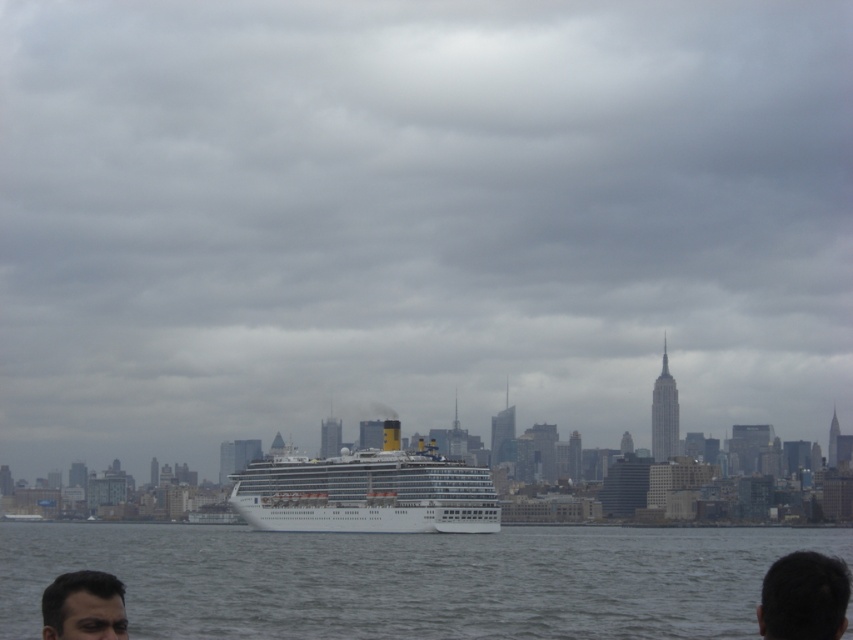
Is white glossy cruise ship at center to the left of dark brown hair at lower left from the viewer's perspective?

In fact, white glossy cruise ship at center is to the right of dark brown hair at lower left.

Identify the location of white glossy cruise ship at center. (367, 492).

Identify the location of white glossy cruise ship at center. (367, 492).

Who is taller, white glossy cruise ship at center or dark hair at lower right?

With more height is dark hair at lower right.

Can you confirm if white glossy cruise ship at center is shorter than dark hair at lower right?

Yes, white glossy cruise ship at center is shorter than dark hair at lower right.

Which is behind, point (334, 460) or point (811, 614)?

Point (334, 460)

Locate an element on the screen. white glossy cruise ship at center is located at coordinates (367, 492).

Between dark hair at lower right and dark brown hair at lower left, which one appears on the left side from the viewer's perspective?

Positioned to the left is dark brown hair at lower left.

Is point (822, 563) farther from viewer compared to point (90, 632)?

Yes, point (822, 563) is farther from viewer.

Which is in front, point (833, 602) or point (120, 589)?

Point (833, 602) is in front.

Identify the location of dark hair at lower right. (804, 596).